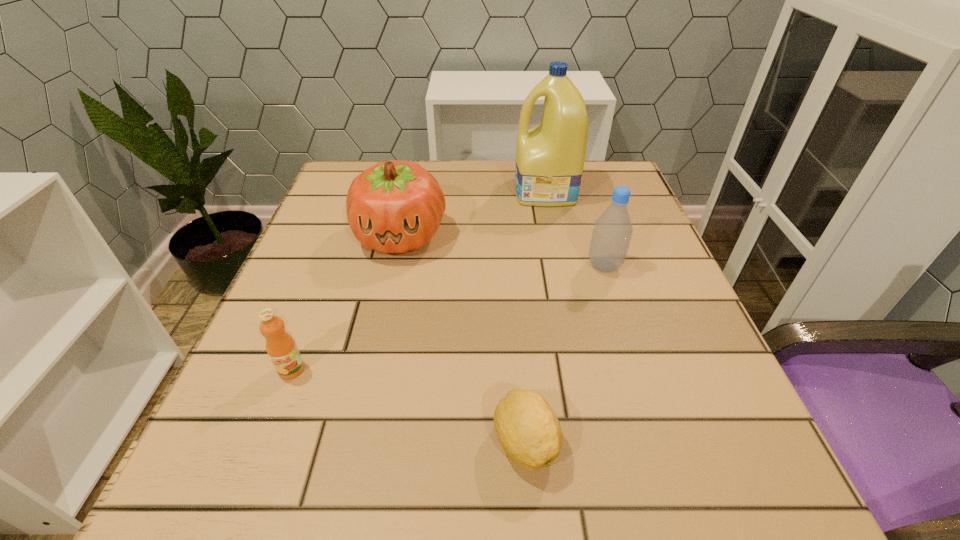
This screenshot has height=540, width=960. I want to click on vacant region located 0.370m on the label of the farthest object, so click(363, 192).

I want to click on vacant area situated on the side of the fourth object from right to left with the cute face, so click(x=357, y=430).

Find the location of `vacant space located 0.140m on the front of the bottle`. vacant space located 0.140m on the front of the bottle is located at coordinates (626, 334).

Find the location of a particular element. vacant space located 0.130m on the front label of the leftmost object is located at coordinates (255, 464).

Locate an element on the screen. detergent that is positioned at the far edge is located at coordinates (550, 157).

Identify the location of pumpkin that is at the far edge. The image size is (960, 540). (396, 206).

I want to click on object that is at the near edge, so click(x=527, y=428).

The height and width of the screenshot is (540, 960). I want to click on pumpkin that is at the left edge, so click(x=396, y=206).

Image resolution: width=960 pixels, height=540 pixels. What are the coordinates of `orange juice that is positioned at the left edge` in the screenshot? It's located at (283, 352).

Locate an element on the screen. detergent located in the right edge section of the desktop is located at coordinates (550, 157).